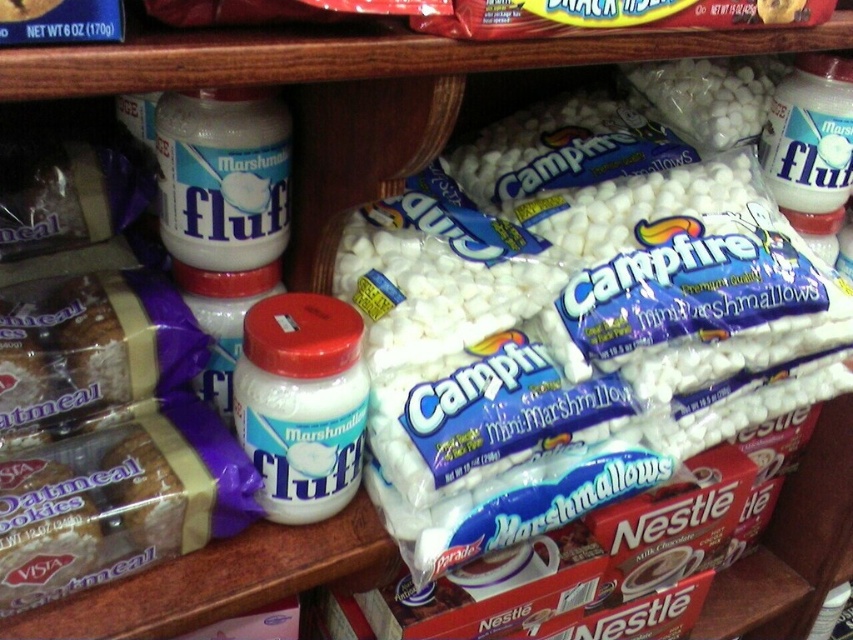
Who is shorter, white matte jar at center-left or matte white marshmallow fluff at left?

matte white marshmallow fluff at left is shorter.

Which is behind, point (299, 477) or point (173, 97)?

The point (173, 97) is behind.

This screenshot has height=640, width=853. I want to click on white matte jar at center-left, so click(x=300, y=403).